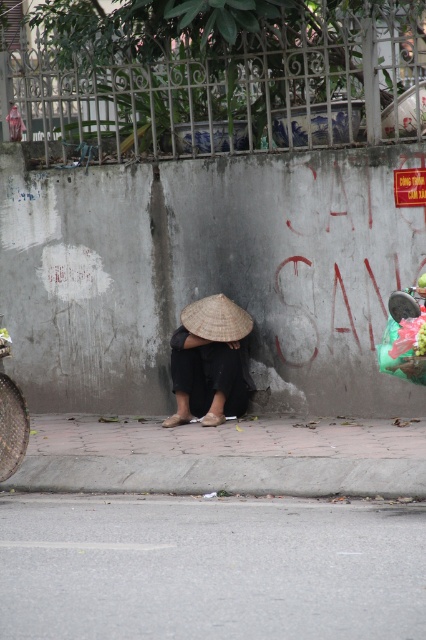
Question: Can you confirm if gray asphalt pavement at lower center is wider than gray concrete curb at lower center?

Choices:
 (A) yes
 (B) no

Answer: (B)

Question: Estimate the real-world distances between objects in this image. Which object is farther from the gray concrete curb at lower center?

Choices:
 (A) matte straw hat at center
 (B) brown straw hat at center

Answer: (B)

Question: Does matte straw hat at center appear over brown straw hat at center?

Choices:
 (A) yes
 (B) no

Answer: (B)

Question: Does gray concrete curb at lower center have a smaller size compared to brown straw hat at center?

Choices:
 (A) yes
 (B) no

Answer: (B)

Question: Which point is farther to the camera?

Choices:
 (A) (351, 493)
 (B) (221, 337)
 (C) (213, 332)

Answer: (C)

Question: Which point appears farthest from the camera in this image?

Choices:
 (A) (210, 332)
 (B) (91, 538)
 (C) (196, 412)

Answer: (C)